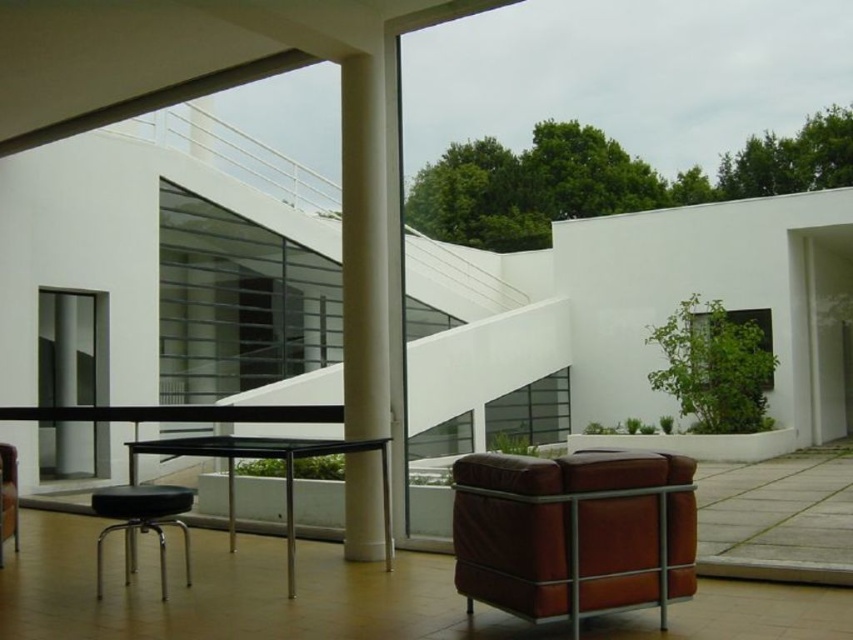
Is black glass table at center below brown leather armchair at lower left?

No, black glass table at center is not below brown leather armchair at lower left.

Does black glass table at center have a lesser width compared to brown leather armchair at lower left?

Incorrect, black glass table at center's width is not less than brown leather armchair at lower left's.

Is point (305, 449) less distant than point (0, 449)?

Yes, it is in front of point (0, 449).

Locate an element on the screen. This screenshot has width=853, height=640. black glass table at center is located at coordinates (268, 458).

Is black glass table at center to the left of black leather stool at lower left from the viewer's perspective?

Incorrect, black glass table at center is not on the left side of black leather stool at lower left.

Describe the element at coordinates (268, 458) in the screenshot. The width and height of the screenshot is (853, 640). I see `black glass table at center` at that location.

I want to click on black glass table at center, so (268, 458).

Is white smooth column at center to the left of black glass table at center from the viewer's perspective?

In fact, white smooth column at center is to the right of black glass table at center.

Can you confirm if white smooth column at center is smaller than black glass table at center?

Yes, white smooth column at center is smaller than black glass table at center.

What do you see at coordinates (364, 248) in the screenshot?
I see `white smooth column at center` at bounding box center [364, 248].

Where is `white smooth column at center`? This screenshot has height=640, width=853. white smooth column at center is located at coordinates (364, 248).